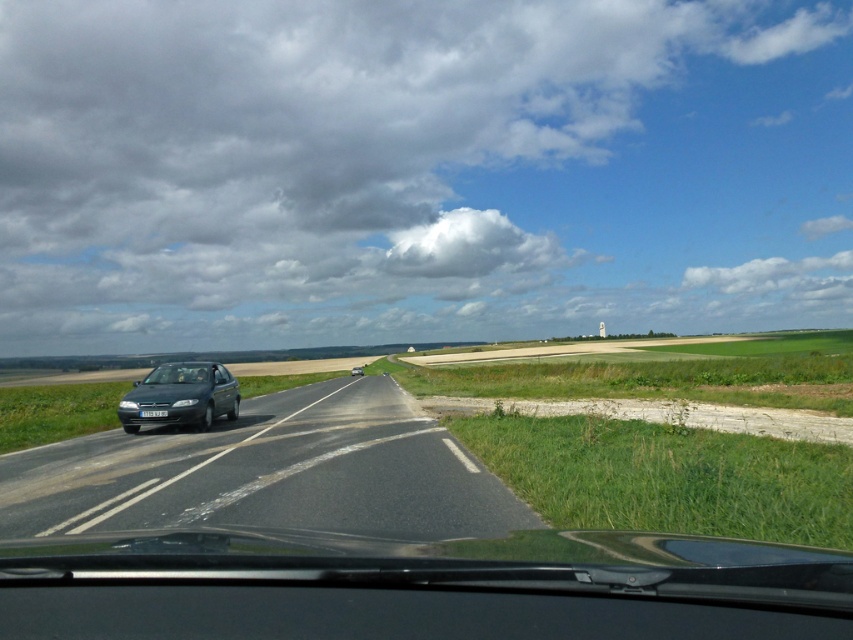
Question: Estimate the real-world distances between objects in this image. Which object is closer to the dark gray metallic car at center?

Choices:
 (A) shiny black car at left
 (B) transparent glass windshield at center
 (C) satin black car at left

Answer: (A)

Question: Is transparent glass windshield at center to the left of dark gray metallic car at center from the viewer's perspective?

Choices:
 (A) no
 (B) yes

Answer: (A)

Question: Among these points, which one is farthest from the camera?

Choices:
 (A) (350, 374)
 (B) (325, 392)
 (C) (206, 413)

Answer: (A)

Question: Which object appears closest to the camera in this image?

Choices:
 (A) transparent glass windshield at center
 (B) shiny black car at left
 (C) dark gray metallic car at center

Answer: (B)

Question: Can you confirm if satin black car at left is smaller than transparent glass windshield at center?

Choices:
 (A) no
 (B) yes

Answer: (A)

Question: Observing the image, what is the correct spatial positioning of shiny black car at left in reference to satin black car at left?

Choices:
 (A) left
 (B) right

Answer: (B)